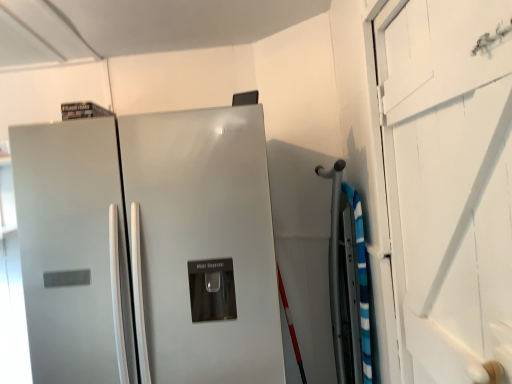
The width and height of the screenshot is (512, 384). Identify the location of white wood door at right. (448, 185).

The width and height of the screenshot is (512, 384). Describe the element at coordinates (448, 185) in the screenshot. I see `white wood door at right` at that location.

Measure the distance between white wood door at right and camera.

The distance of white wood door at right from camera is 26.54 inches.

Measure the distance between point [444,37] and camera.

The depth of point [444,37] is 36.50 inches.

Locate an element on the screen. white wood door at right is located at coordinates (448, 185).